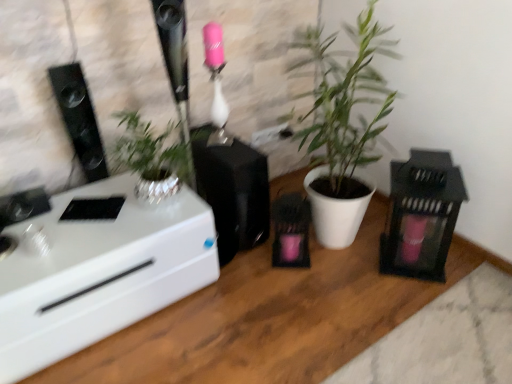
You are a GUI agent. You are given a task and a screenshot of the screen. Output one action in this format:
    pyautogui.click(x=<x>, y=<y>)
    Task: Click on the vacant space in front of black glossy speaker at left
    This screenshot has height=384, width=512.
    Given the screenshot: What is the action you would take?
    pyautogui.click(x=89, y=199)